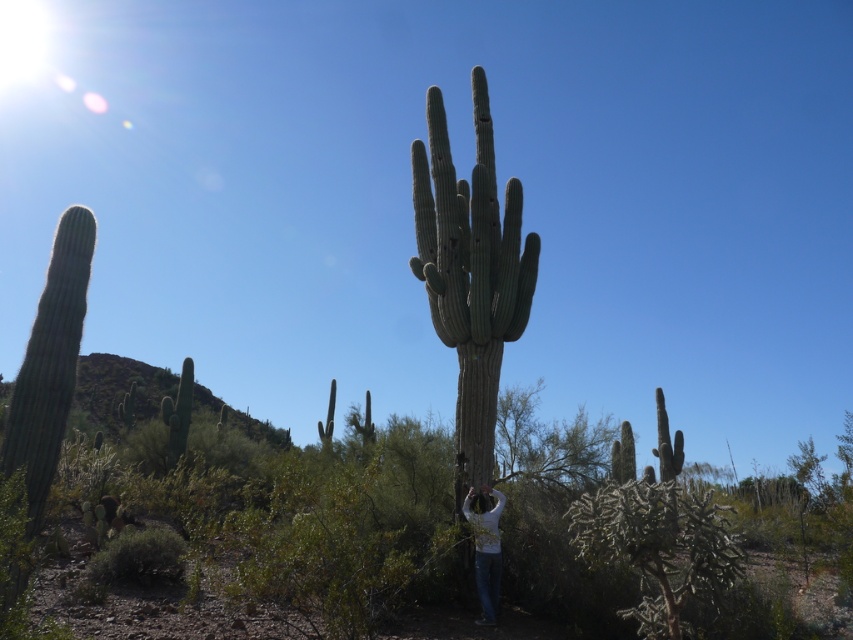
Question: Does green spiny cactus at center appear under white matte shirt at center?

Choices:
 (A) yes
 (B) no

Answer: (B)

Question: Is green spiny cactus at center smaller than white matte shirt at center?

Choices:
 (A) yes
 (B) no

Answer: (B)

Question: Considering the relative positions of green spiny cactus at center and white matte shirt at center in the image provided, where is green spiny cactus at center located with respect to white matte shirt at center?

Choices:
 (A) above
 (B) below

Answer: (A)

Question: Which point is farther from the camera taking this photo?

Choices:
 (A) (486, 216)
 (B) (469, 512)

Answer: (A)

Question: Among these points, which one is nearest to the camera?

Choices:
 (A) (468, 412)
 (B) (485, 524)

Answer: (B)

Question: Which point is closer to the camera?

Choices:
 (A) green spiny cactus at center
 (B) white matte shirt at center

Answer: (B)